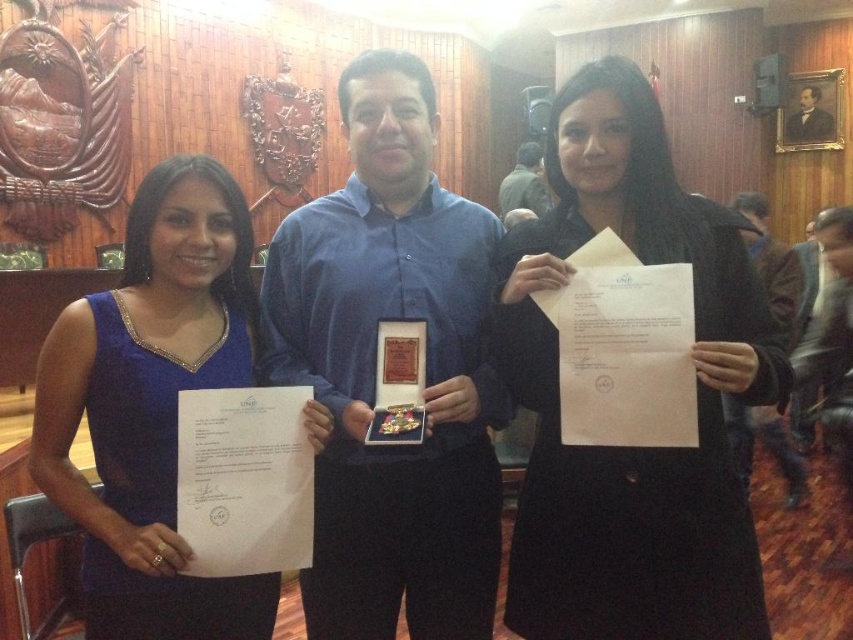
You are an event photographer at the ceremony. You want to take a photo of the blue shirt at center and the black matte coat at center. Based on their positions, which one is more likely to be partially blocked by the other?

The blue shirt at center is positioned under the black matte coat at center, so the blue shirt at center is more likely to be partially blocked by the black matte coat at center.

You are an event photographer at the ceremony and need to capture a photo of both the black matte coat at center and the brown leather jacket at right. Based on their positions, which one should you focus on first to ensure both are in the frame?

The black matte coat at center is to the left of brown leather jacket at right, so you should focus on the brown leather jacket at right first to ensure both are in the frame.